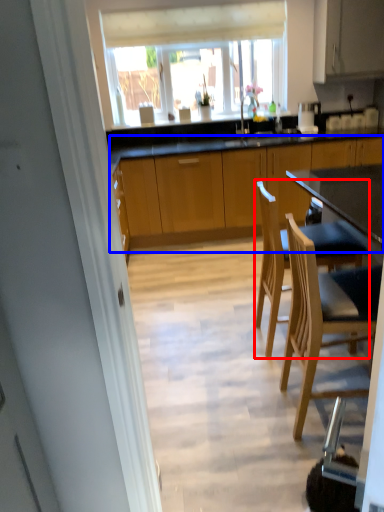
Question: Which object appears closest to the camera in this image, chair (highlighted by a red box) or cabinetry (highlighted by a blue box)?

Choices:
 (A) chair
 (B) cabinetry

Answer: (A)